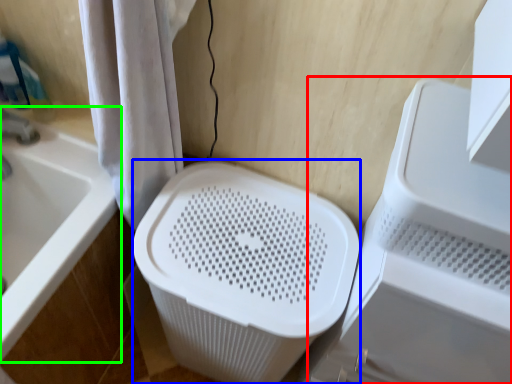
Question: Which object is the farthest from appliance (highlighted by a red box)? Choose among these: laundry basket (highlighted by a blue box) or bathtub (highlighted by a green box).

Choices:
 (A) laundry basket
 (B) bathtub

Answer: (B)